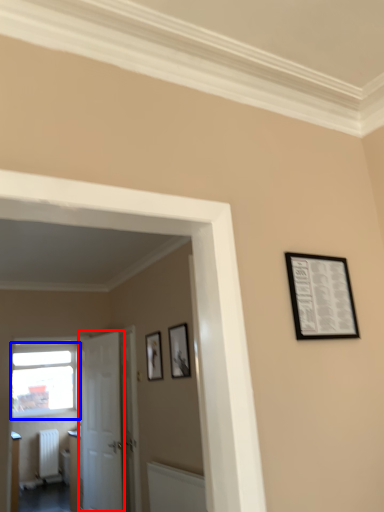
Question: Which object is closer to the camera taking this photo, door (highlighted by a red box) or window (highlighted by a blue box)?

Choices:
 (A) door
 (B) window

Answer: (A)